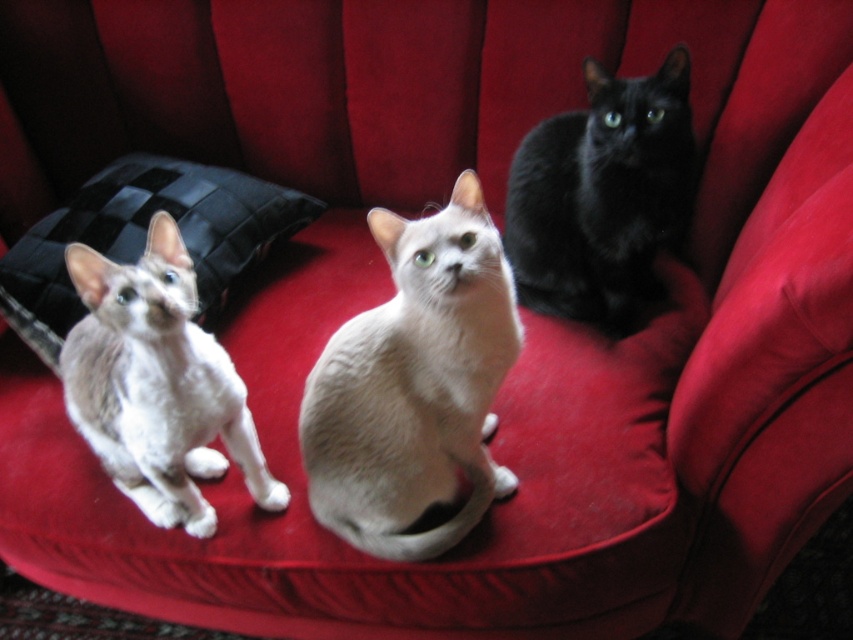
Question: Can you confirm if silvery white fur cat at left is positioned above black silky cat at upper right?

Choices:
 (A) yes
 (B) no

Answer: (B)

Question: Can you confirm if silvery white fur cat at left is positioned to the right of black quilted pillow at left?

Choices:
 (A) yes
 (B) no

Answer: (A)

Question: Which object is positioned farthest from the silvery white fur cat at left?

Choices:
 (A) white matte cat at center
 (B) black quilted pillow at left
 (C) black silky cat at upper right

Answer: (C)

Question: Does black silky cat at upper right have a larger size compared to black quilted pillow at left?

Choices:
 (A) yes
 (B) no

Answer: (B)

Question: Which is farther from the black quilted pillow at left?

Choices:
 (A) silvery white fur cat at left
 (B) black silky cat at upper right
 (C) white matte cat at center

Answer: (B)

Question: Which point is closer to the camera taking this photo?

Choices:
 (A) (312, 372)
 (B) (521, 232)
 (C) (248, 196)
 (D) (254, 490)

Answer: (A)